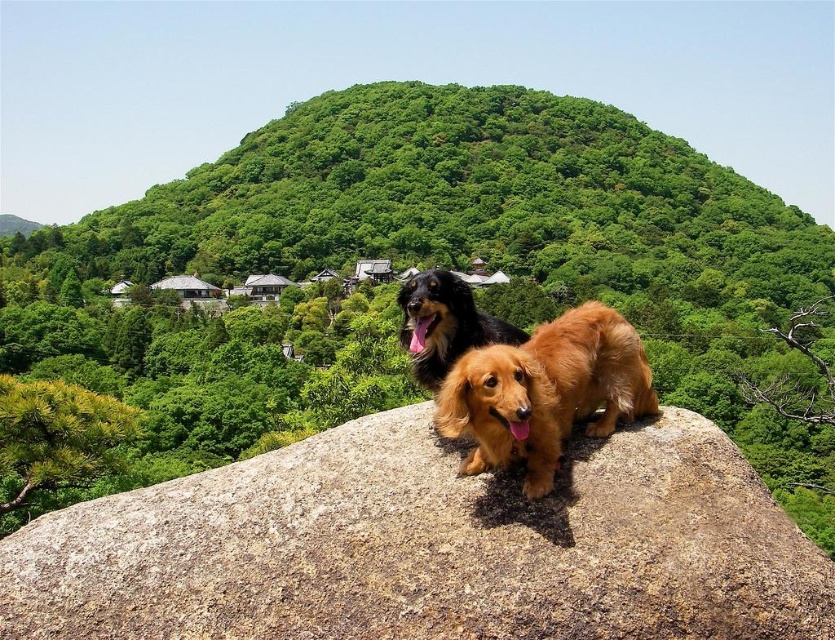
Between brown textured rock at center and golden brown fur at center, which one has more height?

golden brown fur at center

The image size is (835, 640). I want to click on brown textured rock at center, so click(429, 547).

Where is `brown textured rock at center`? The width and height of the screenshot is (835, 640). brown textured rock at center is located at coordinates (429, 547).

Who is more distant from viewer, (524, 435) or (424, 294)?

Point (424, 294)

Is point (537, 380) positioned before point (406, 291)?

Yes, point (537, 380) is closer to viewer.

Locate an element on the screen. This screenshot has width=835, height=640. golden brown fur at center is located at coordinates (544, 392).

Locate an element on the screen. green leafy hillside at center is located at coordinates (428, 268).

Is point (196, 428) farther from camera compared to point (321, 541)?

Yes, it is behind point (321, 541).

I want to click on green leafy hillside at center, so click(x=428, y=268).